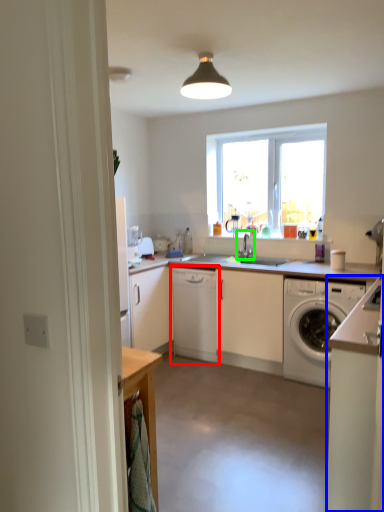
Question: Which is nearer to the cabinetry (highlighted by a red box)? cabinetry (highlighted by a blue box) or tap (highlighted by a green box).

Choices:
 (A) cabinetry
 (B) tap

Answer: (B)